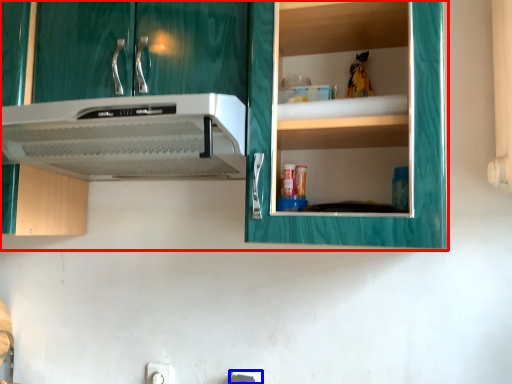
Question: Which object is further to the camera taking this photo, cabinetry (highlighted by a red box) or electric outlet (highlighted by a blue box)?

Choices:
 (A) cabinetry
 (B) electric outlet

Answer: (B)